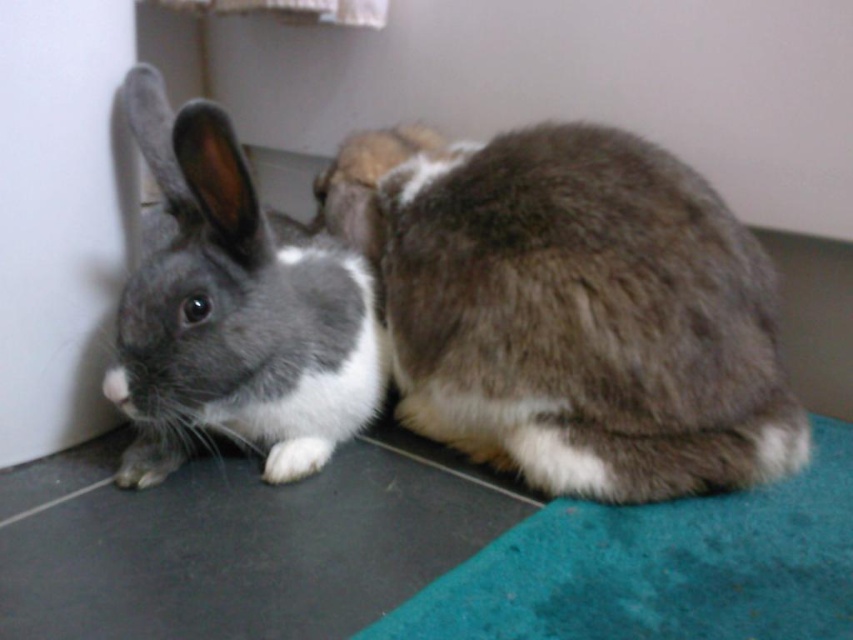
Is point (672, 472) positioned in front of point (297, 342)?

That is True.

Where is `brown fuzzy rabbit at center`? The image size is (853, 640). brown fuzzy rabbit at center is located at coordinates (572, 308).